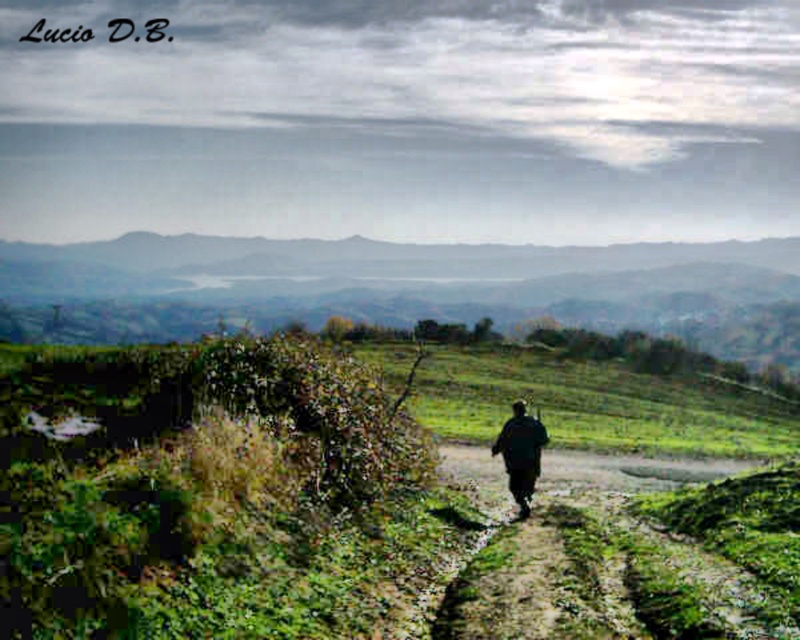
Is green grassy hill at center behind dark green fabric at center?

Yes, it is.

Does green grassy hill at center appear over dark green fabric at center?

Yes.

Where is `green grassy hill at center`? This screenshot has width=800, height=640. green grassy hill at center is located at coordinates (434, 282).